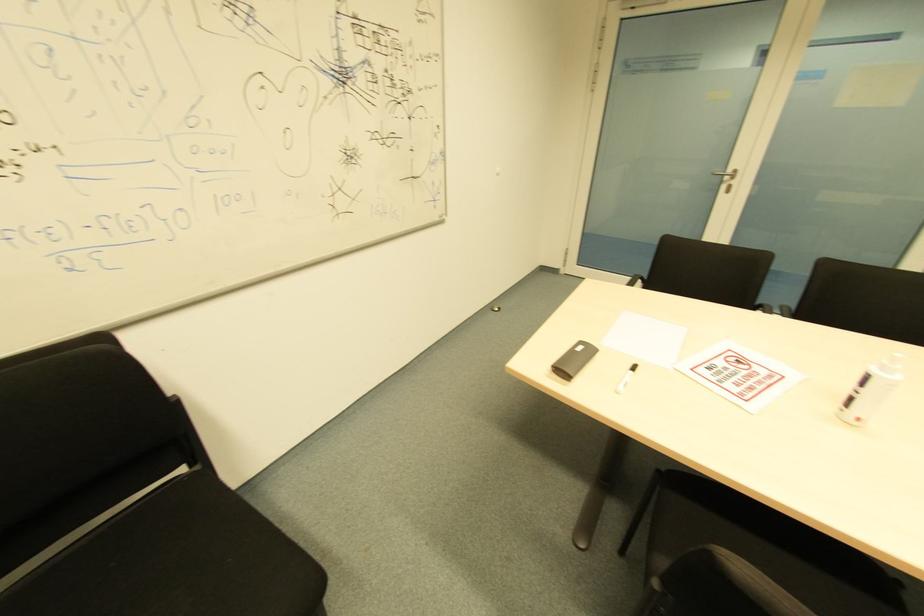
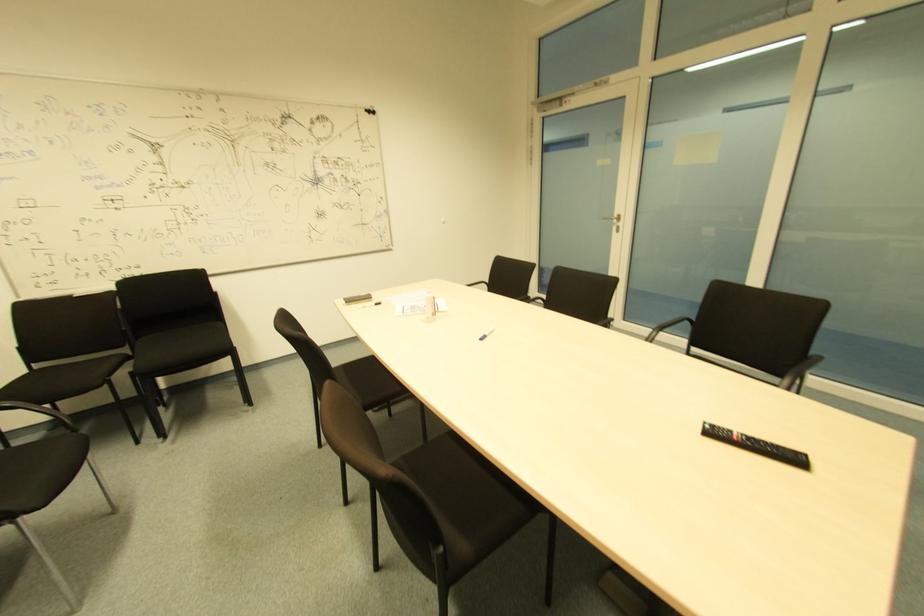
Which direction would the cameraman need to move to produce the second image?

The cameraman walked toward right, backward.